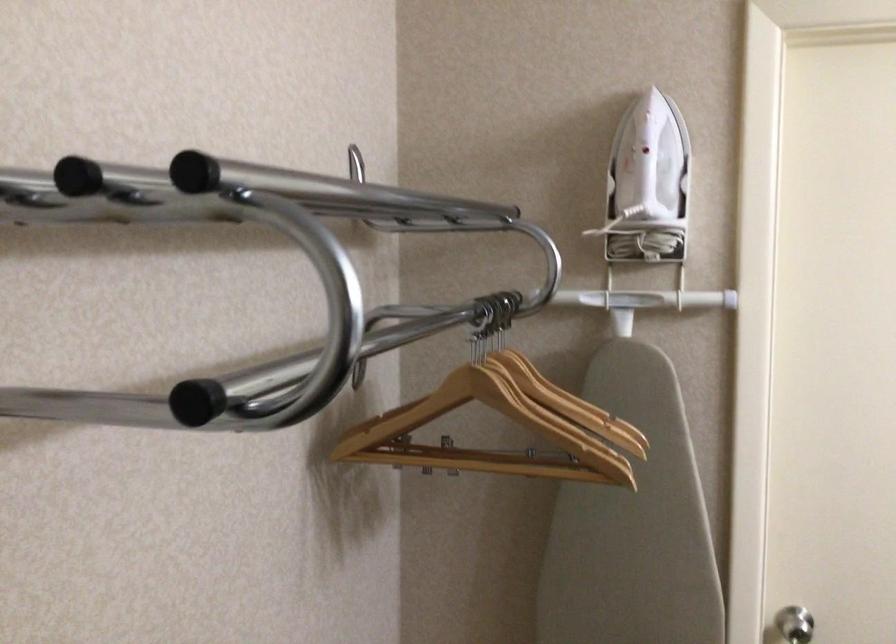
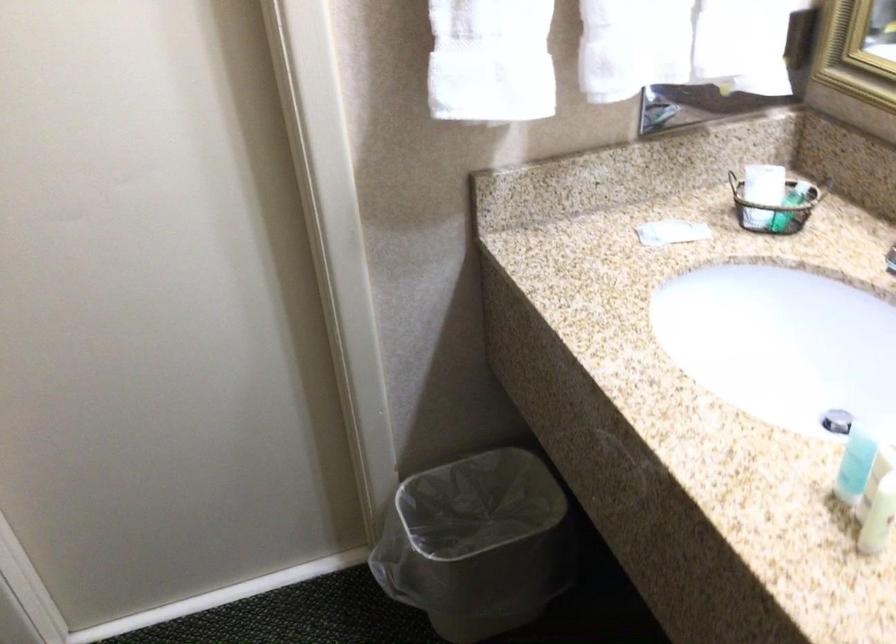
Based on the continuous images, in which direction is the camera rotating?

The camera rotated toward right-down.